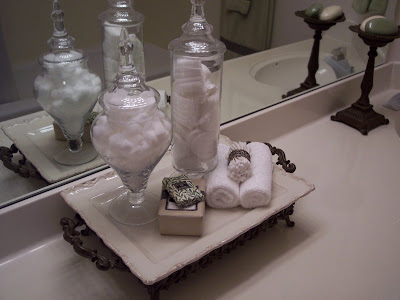
You are a GUI agent. You are given a task and a screenshot of the screen. Output one action in this format:
    pyautogui.click(x=<x>, y=<y>)
    Task: Click on the oval hand soap
    
    Given the screenshot: What is the action you would take?
    pyautogui.click(x=378, y=25), pyautogui.click(x=368, y=19)